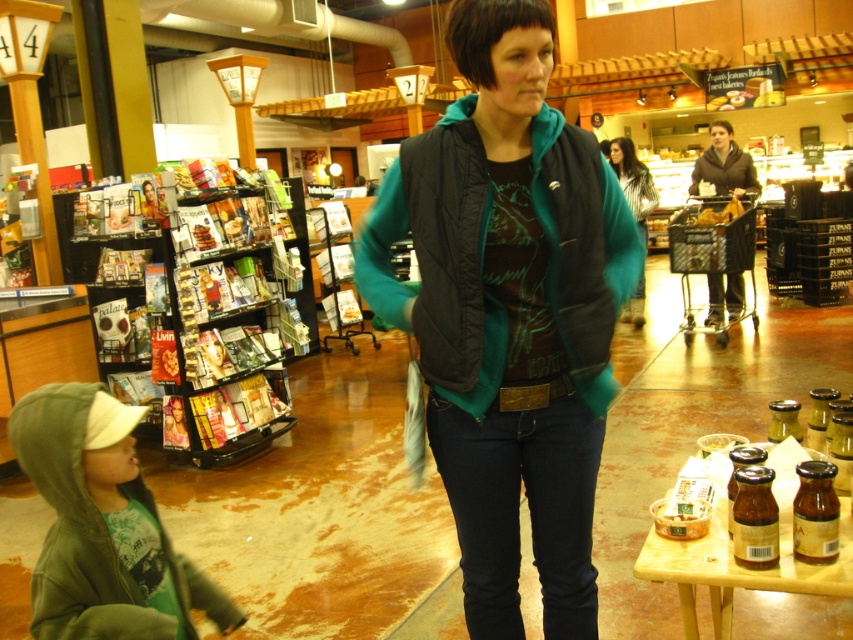
Question: Estimate the real-world distances between objects in this image. Which object is closer to the green fleece hoodie at lower left?

Choices:
 (A) striped fabric shirt at center
 (B) black quilted vest at center
 (C) metallic magazine rack at left

Answer: (B)

Question: Where is black quilted vest at center located in relation to striped fabric shirt at center in the image?

Choices:
 (A) below
 (B) above

Answer: (A)

Question: Is green fleece hoodie at lower left closer to the viewer compared to striped fabric shirt at center?

Choices:
 (A) yes
 (B) no

Answer: (A)

Question: Which object appears farthest from the camera in this image?

Choices:
 (A) black quilted vest at center
 (B) striped fabric shirt at center
 (C) green fleece hoodie at lower left

Answer: (B)

Question: Can you confirm if black quilted vest at center is wider than striped fabric shirt at center?

Choices:
 (A) yes
 (B) no

Answer: (A)

Question: Estimate the real-world distances between objects in this image. Which object is closer to the metallic magazine rack at left?

Choices:
 (A) green fleece hoodie at lower left
 (B) black quilted vest at center
 (C) striped fabric shirt at center

Answer: (A)